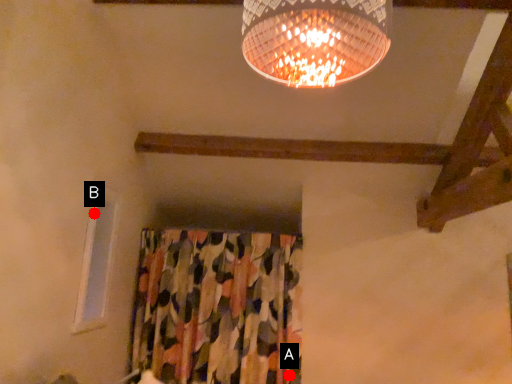
Question: Two points are circled on the image, labeled by A and B beside each circle. Which point appears closest to the camera in this image?

Choices:
 (A) A is closer
 (B) B is closer

Answer: (B)